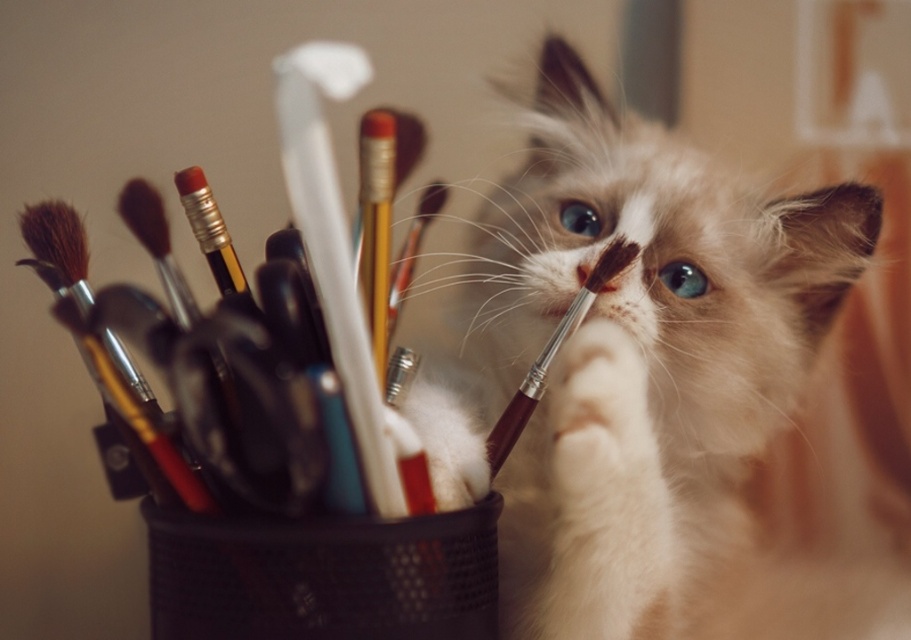
Question: Which point is closer to the camera taking this photo?

Choices:
 (A) [545, 180]
 (B) [579, 323]

Answer: (B)

Question: Which object is farther from the camera taking this photo?

Choices:
 (A) brown wooden paint brush at center
 (B) white fluffy cat at center

Answer: (A)

Question: Can you confirm if white fluffy cat at center is positioned below brown wooden paint brush at center?

Choices:
 (A) no
 (B) yes

Answer: (A)

Question: Does white fluffy cat at center have a smaller size compared to brown wooden paint brush at center?

Choices:
 (A) no
 (B) yes

Answer: (A)

Question: Is white fluffy cat at center to the left of brown wooden paint brush at center from the viewer's perspective?

Choices:
 (A) no
 (B) yes

Answer: (A)

Question: Among these objects, which one is farthest from the camera?

Choices:
 (A) white fluffy cat at center
 (B) brown wooden paint brush at center

Answer: (B)